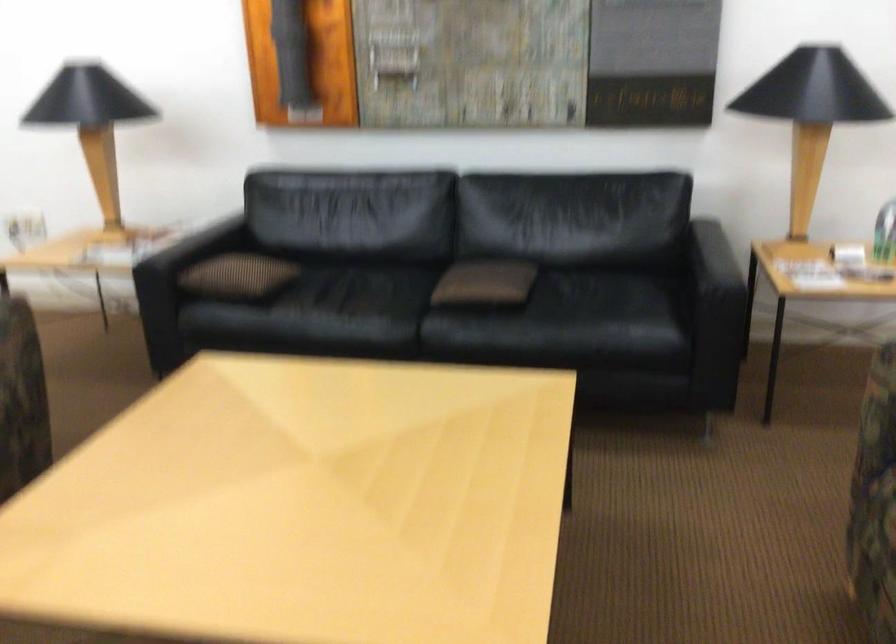
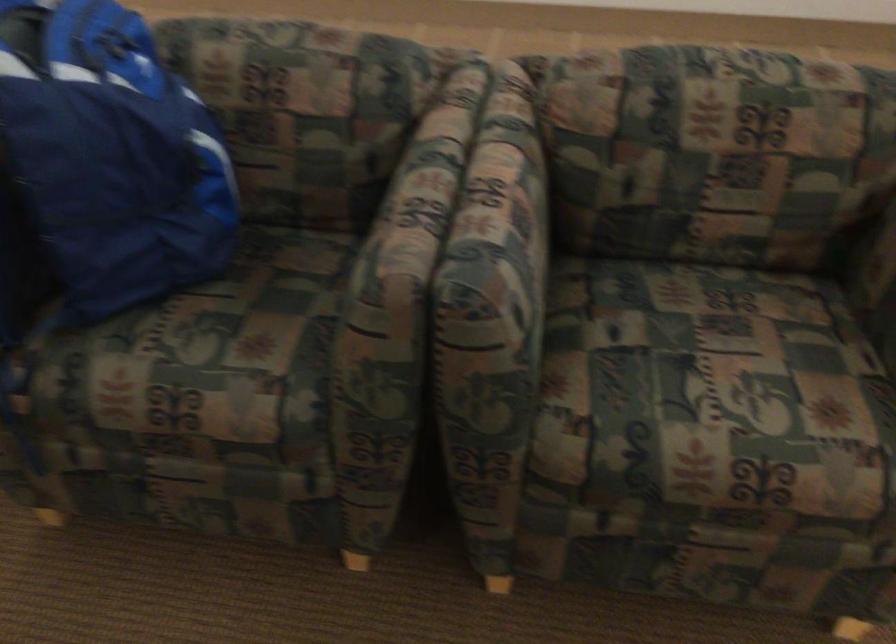
Consider the image. Based on the continuous images, in which direction is the camera rotating?

The camera rotated toward right-down.